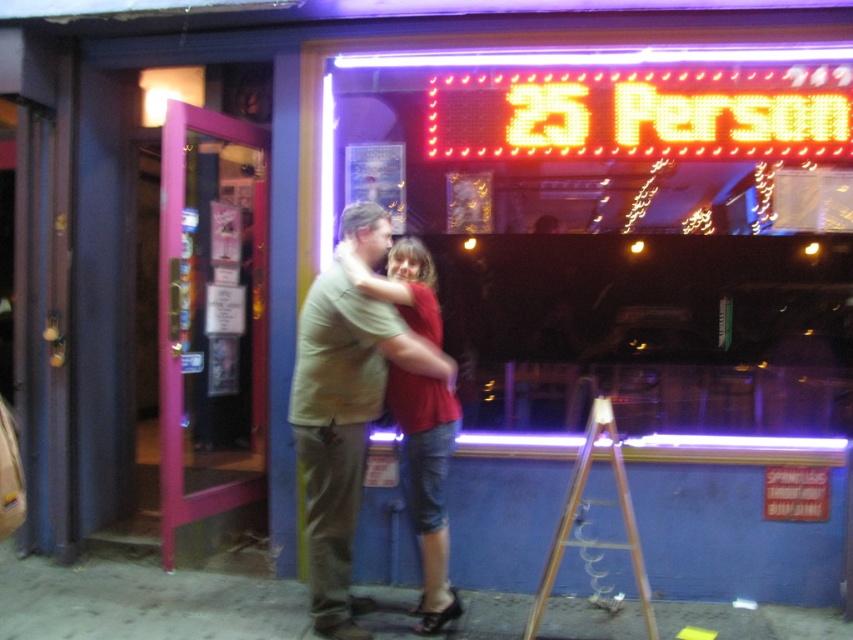
Is beige cotton shirt at center smaller than wooden at center?

No.

Does point (303, 460) come behind point (573, 490)?

Yes, it is behind point (573, 490).

The image size is (853, 640). Identify the location of beige cotton shirt at center. (343, 426).

The width and height of the screenshot is (853, 640). What are the coordinates of `beige cotton shirt at center` in the screenshot? It's located at (343, 426).

Is orange led sign at upper center smaller than wooden at center?

Yes, orange led sign at upper center is smaller than wooden at center.

Who is taller, orange led sign at upper center or wooden at center?

With more height is wooden at center.

Which is behind, point (717, 96) or point (538, 588)?

Point (717, 96)

The width and height of the screenshot is (853, 640). Identify the location of orange led sign at upper center. (640, 113).

Between orange led sign at upper center and beige cotton shirt at center, which one has less height?

orange led sign at upper center

Between orange led sign at upper center and beige cotton shirt at center, which one is positioned higher?

orange led sign at upper center

Between point (556, 113) and point (431, 371), which one is positioned behind?

The point (556, 113) is behind.

In order to click on orange led sign at upper center in this screenshot , I will do `click(640, 113)`.